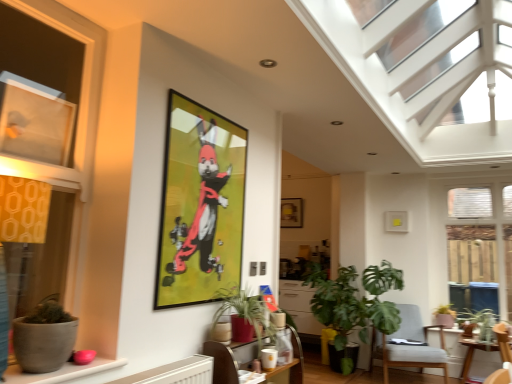
Question: Visually, is matte ceramic pot at lower center, which appears as the second flowerpot when viewed from the top, positioned to the left or to the right of metallic gold picture frame at upper center, placed as the 2th picture frame when sorted from back to front?

Choices:
 (A) right
 (B) left

Answer: (A)

Question: In terms of width, does matte ceramic pot at lower center, the second flowerpot viewed from the back, look wider or thinner when compared to metallic gold picture frame at upper center, placed as the 1th picture frame when sorted from left to right?

Choices:
 (A) thin
 (B) wide

Answer: (B)

Question: Considering the real-world distances, which object is closest to the green matte plant at right, which is the first houseplant in back-to-front order?

Choices:
 (A) wooden table at center, the first table from the top
 (B) matte wooden picture frame at center, the 1th picture frame positioned from the back
 (C) matte gray window sill at lower left
 (D) wooden table at lower right, positioned as the first table in back-to-front order
 (E) clear glass door at right, the 1th window viewed from the right

Answer: (D)

Question: Based on their relative distances, which object is farther from the matte gray window sill at lower left?

Choices:
 (A) matte wooden picture frame at center, the 1th picture frame positioned from the back
 (B) clear glass door at right, which ranks as the 3th window in left-to-right order
 (C) wooden table at center, marked as the second table in a bottom-to-top arrangement
 (D) metallic gold picture frame at upper center, which appears as the 1th picture frame when viewed from the front
 (E) wooden table at lower right, the first table from the bottom

Answer: (B)